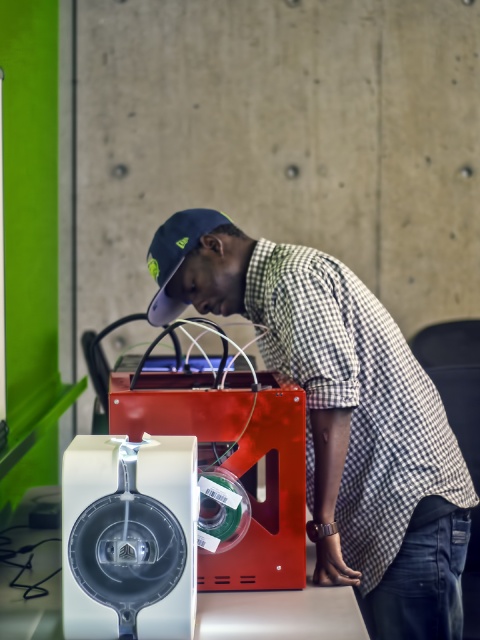
You are observing a person working with a 3D printer. You notice the checkered fabric shirt at center and the navy blue fabric baseball cap at center. Which of these items is positioned lower on the person?

The checkered fabric shirt at center is located below the navy blue fabric baseball cap at center, so the shirt is positioned lower on the person.

Where is the checkered fabric shirt at center located in the image?

The checkered fabric shirt at center is located at point [342,417] in the image.